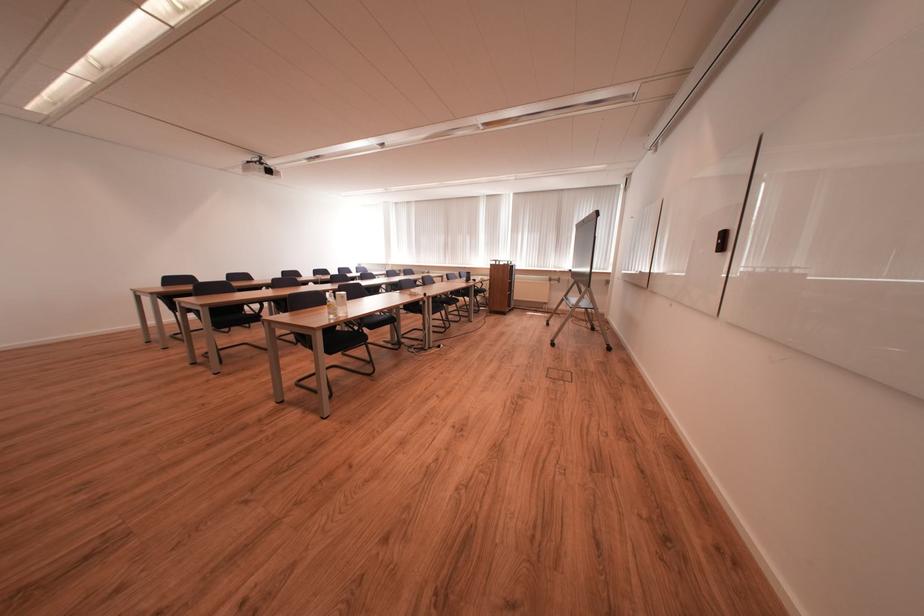
Locate an element on the screen. Image resolution: width=924 pixels, height=616 pixels. floor socket cover is located at coordinates (261, 171).